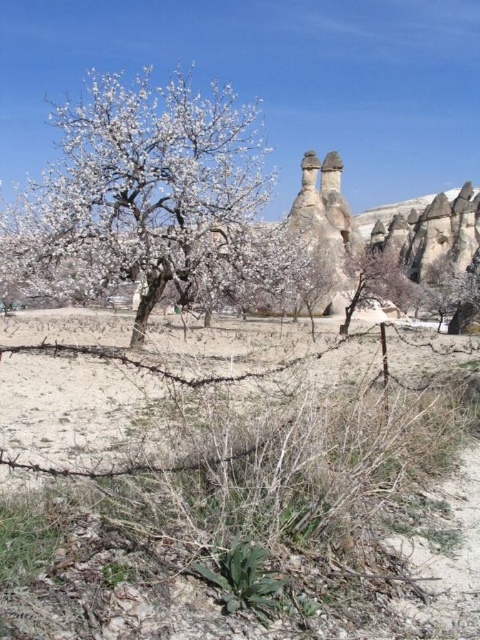
You are a hiker who wants to take a photo of the white blossoming tree at center and the brown sandy dirt field at center. Which one should you focus on first if you want to capture both in one shot?

The white blossoming tree at center is above the brown sandy dirt field at center, so you should focus on the white blossoming tree at center first to ensure both are in focus.

You are a landscape photographer planning to capture the white blossoming tree at center and the brown sandy dirt field at center in a single shot. Which object will appear narrower in your photograph?

The white blossoming tree at center is thinner than the brown sandy dirt field at center, so it will appear narrower in the photograph.

You are a landscape architect planning to install a new irrigation system. The system requires a minimum of 100 feet of space between the white blossoming tree at center and the brown sandy dirt field at center to ensure proper water distribution. Based on the image, will this spacing requirement be met?

The distance between the white blossoming tree at center and the brown sandy dirt field at center is 122.00 feet, which exceeds the required 100 feet. Therefore, the spacing requirement for the irrigation system will be met.